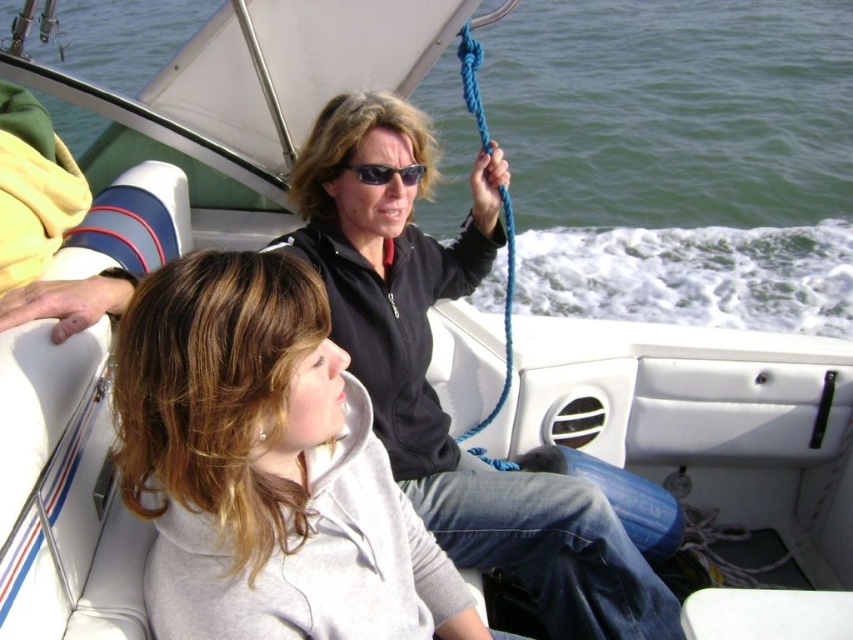
You are planning to place a small cooler between the gray fleece jacket at center and the black matte jacket at upper center. Which jacket should the cooler be closer to if you want it to be near the larger space occupied by one of them?

The cooler should be placed closer to the black matte jacket at upper center because it occupies more space than the gray fleece jacket at center.

You are a photographer trying to capture a photo of the two people on the boat. You want to ensure both the gray fleece jacket at center and the black matte jacket at upper center are clearly visible in the frame. Based on their positions, which jacket should you focus on first to ensure both are in focus?

The gray fleece jacket at center is positioned on the left side of black matte jacket at upper center, so focusing on the black matte jacket at upper center first would help ensure both are in focus as they are closer to the center of the frame.

You are a photographer trying to capture a closeup of the black plastic sunglasses at center while ensuring the black matte jacket at upper center is still visible in the frame. Given their relative heights, which object should you focus on first to ensure both are in focus?

Since the black matte jacket at upper center is taller than the black plastic sunglasses at center, you should focus on the black matte jacket at upper center first to ensure both are in focus.